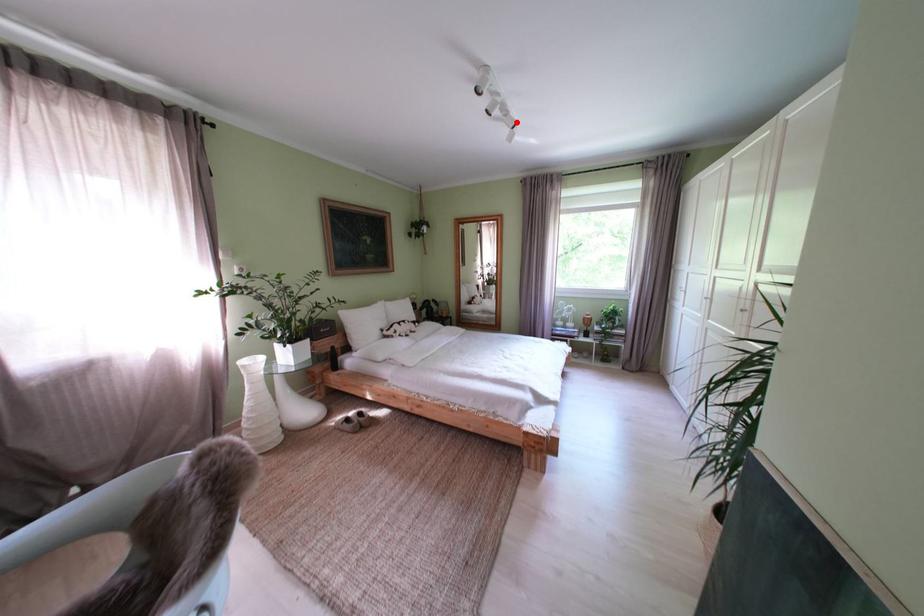
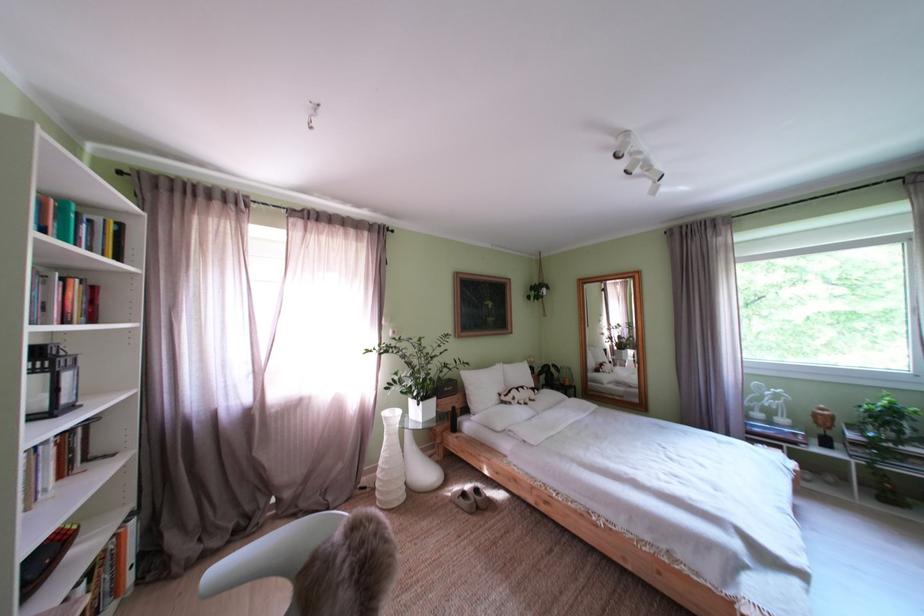
Locate, in the second image, the point that corresponds to the highlighted location in the first image.

(659, 175)